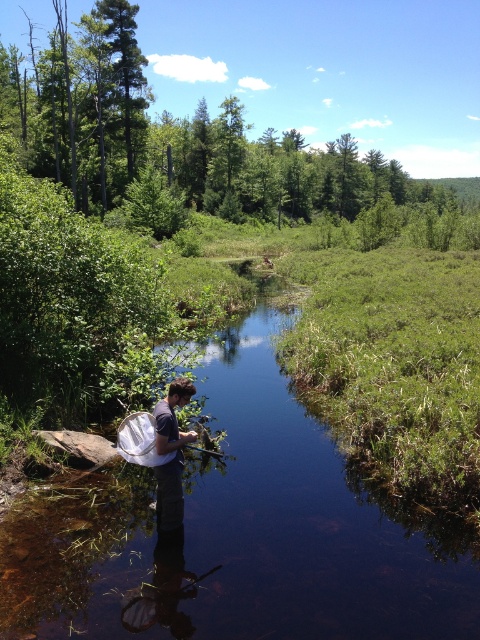
In order to click on clear water at center in this screenshot , I will do `click(236, 536)`.

Is the position of clear water at center less distant than that of dark blue fabric shirt at center?

Yes, clear water at center is closer to the viewer.

Which is in front, point (242, 451) or point (162, 416)?

Point (162, 416) is in front.

The width and height of the screenshot is (480, 640). I want to click on clear water at center, so (x=236, y=536).